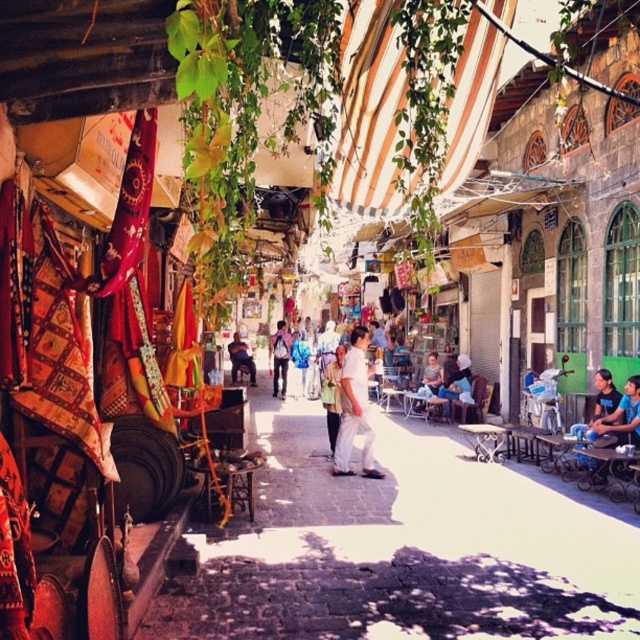
You are a traveler who wants to purchase a gift for a friend. You see a white cotton shirt at center and a dark brown leather bag at center. Which item is more suitable to carry multiple items in?

The dark brown leather bag at center is larger than the white cotton shirt at center, so it is more suitable for carrying multiple items.

Consider the image. You are a traveler who just arrived at this market and want to buy a souvenir. You see a white cotton shirt at center and a light brown leather backpack at center. Which item is bigger in size?

The white cotton shirt at center is larger in size compared to the light brown leather backpack at center.